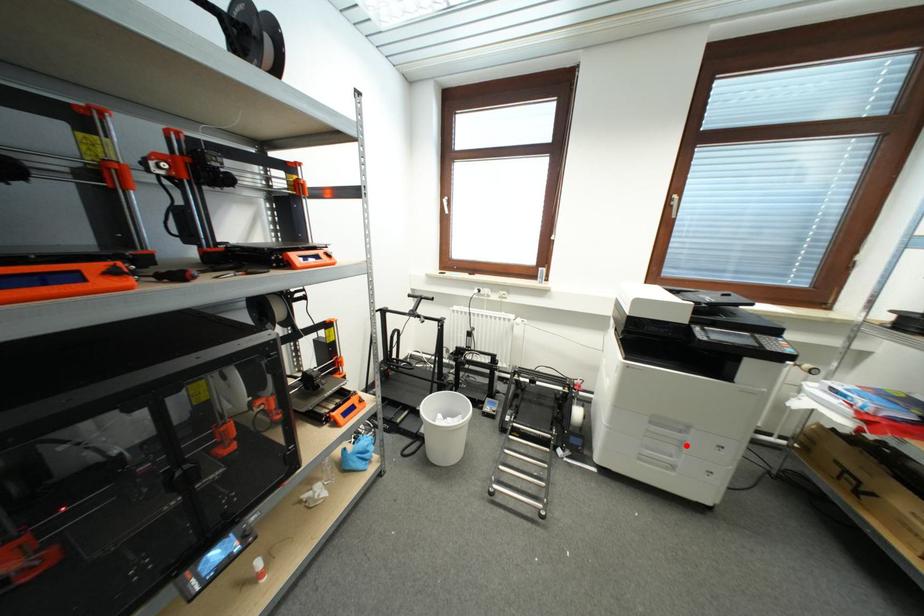
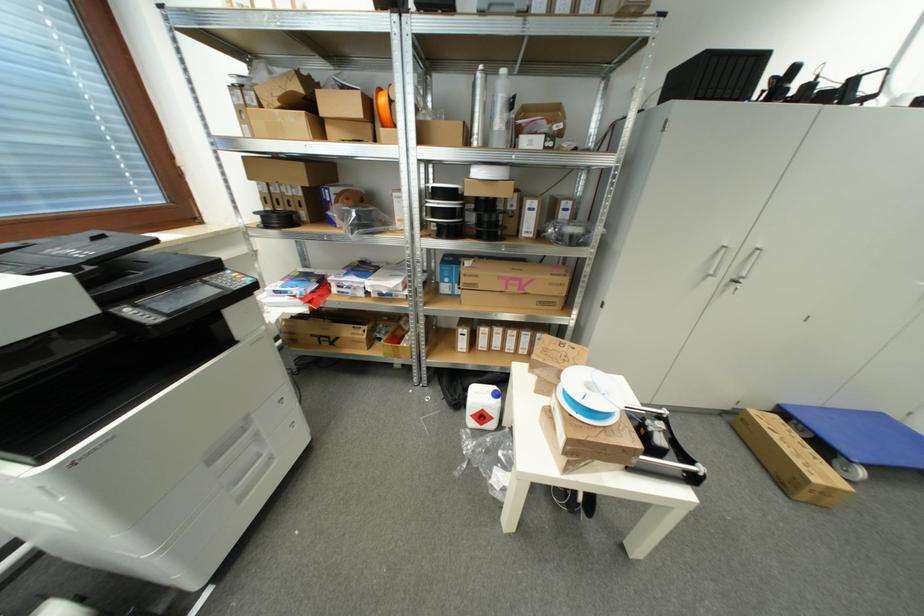
Locate, in the second image, the point that corresponds to the highlighted location in the first image.

(261, 438)